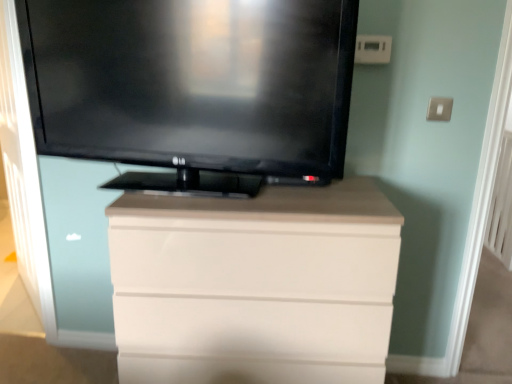
Question: Does white glossy chest of drawers at center appear on the right side of black glossy tv at upper center?

Choices:
 (A) no
 (B) yes

Answer: (B)

Question: Considering the relative sizes of white glossy chest of drawers at center and black glossy tv at upper center in the image provided, is white glossy chest of drawers at center shorter than black glossy tv at upper center?

Choices:
 (A) yes
 (B) no

Answer: (B)

Question: Is white glossy chest of drawers at center directly adjacent to black glossy tv at upper center?

Choices:
 (A) yes
 (B) no

Answer: (B)

Question: From the image's perspective, is white glossy chest of drawers at center under black glossy tv at upper center?

Choices:
 (A) no
 (B) yes

Answer: (B)

Question: Is black glossy tv at upper center located within white glossy chest of drawers at center?

Choices:
 (A) no
 (B) yes

Answer: (A)

Question: Can you confirm if white glossy chest of drawers at center is bigger than black glossy tv at upper center?

Choices:
 (A) yes
 (B) no

Answer: (A)

Question: From a real-world perspective, is black glossy tv at upper center over white glossy chest of drawers at center?

Choices:
 (A) yes
 (B) no

Answer: (A)

Question: From a real-world perspective, is black glossy tv at upper center below white glossy chest of drawers at center?

Choices:
 (A) no
 (B) yes

Answer: (A)

Question: Is black glossy tv at upper center positioned in front of white glossy chest of drawers at center?

Choices:
 (A) no
 (B) yes

Answer: (B)

Question: Considering the relative sizes of black glossy tv at upper center and white glossy chest of drawers at center in the image provided, is black glossy tv at upper center shorter than white glossy chest of drawers at center?

Choices:
 (A) yes
 (B) no

Answer: (A)

Question: Is black glossy tv at upper center bigger than white glossy chest of drawers at center?

Choices:
 (A) yes
 (B) no

Answer: (B)

Question: Does black glossy tv at upper center have a smaller size compared to white glossy chest of drawers at center?

Choices:
 (A) yes
 (B) no

Answer: (A)

Question: Considering the relative positions of black glossy tv at upper center and white glossy chest of drawers at center in the image provided, is black glossy tv at upper center to the left or to the right of white glossy chest of drawers at center?

Choices:
 (A) left
 (B) right

Answer: (A)